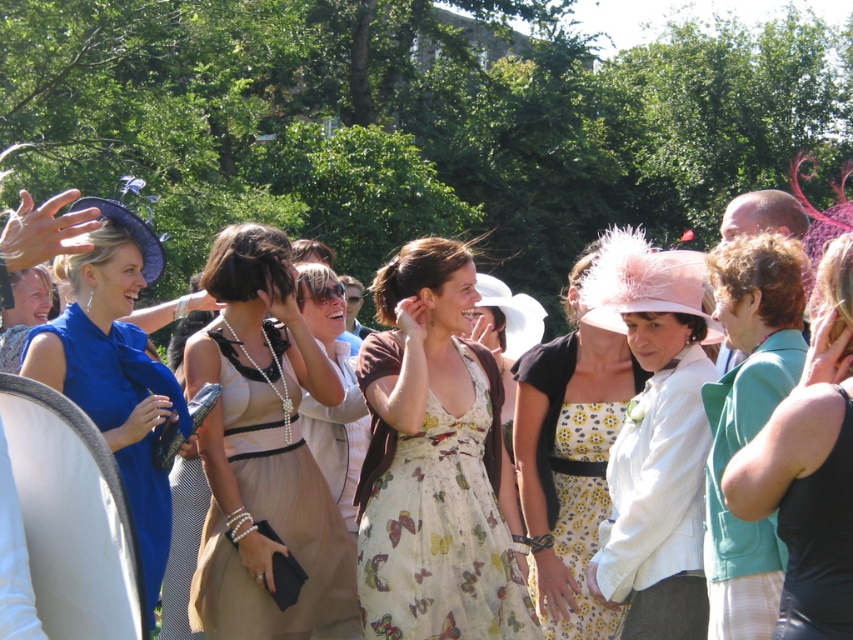
You are a photographer at the event and want to take a photo of the beige satin dress at center. Where should you position your camera to capture it in the frame?

The beige satin dress at center is located at point (276, 531), so you should position your camera to focus on that coordinate to capture it in the frame.

In the scene shown: You are planning to sit between two women wearing the beige satin dress at center and the yellow floral fabric dress at center. Which dress should you choose to sit closer to if you want to ensure more space around you?

You should sit closer to the beige satin dress at center because it is bigger than the yellow floral fabric dress at center, providing more space around you.